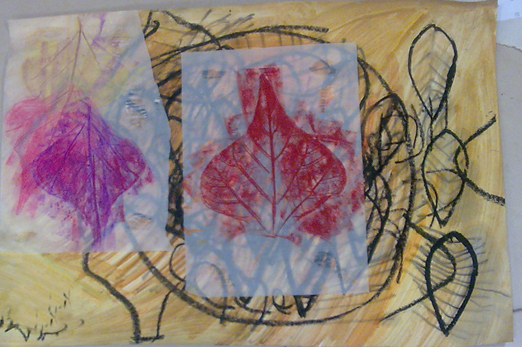
Where is `top of artwork`? The image size is (522, 347). top of artwork is located at coordinates (255, 18).